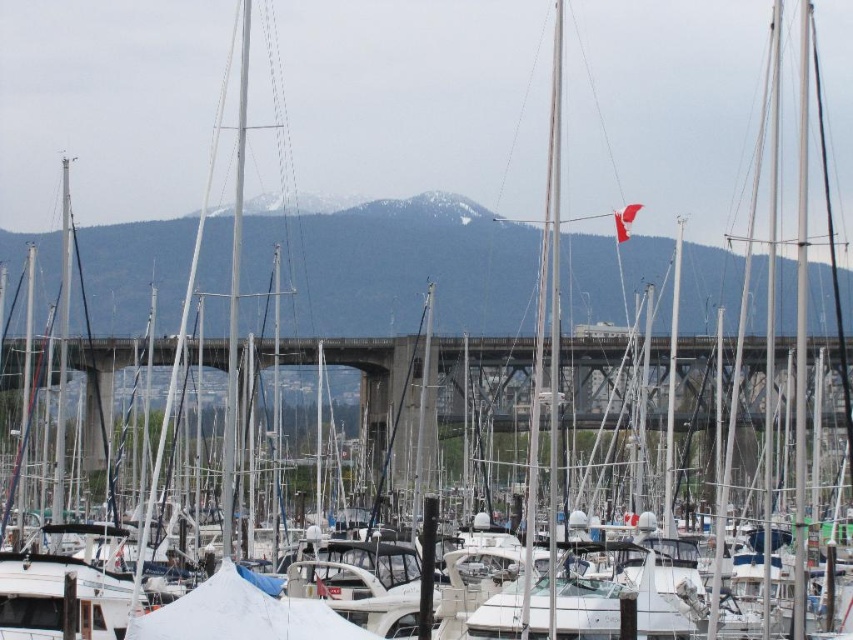
You are a photographer planning to capture a landscape shot of the snowy mountain at upper center and the concrete bridge at center. Based on their sizes in the image, which object would appear larger in your photo?

The snowy mountain at upper center appears larger in the photo because it has a greater height compared to the concrete bridge at center.

You are a photographer standing at the edge of the marina, aiming to capture a wide shot of both the snowy mountain at upper center and the concrete bridge at center. Given their distance apart, will you be able to fit both into your camera frame without moving your position?

The snowy mountain at upper center is 40.55 meters away from the concrete bridge at center. Since the photographer is at the edge of the marina, they can likely capture both in a single wide shot as the distance between them allows for a comprehensive view without needing to reposition.

You are a photographer planning to capture a wide shot of the snowy mountain at upper center and the concrete bridge at center. Based on their sizes, which object should you focus on to ensure both are fully visible in the frame?

The snowy mountain at upper center might be wider than the concrete bridge at center, so focusing on the snowy mountain at upper center would ensure both are fully visible in the frame.